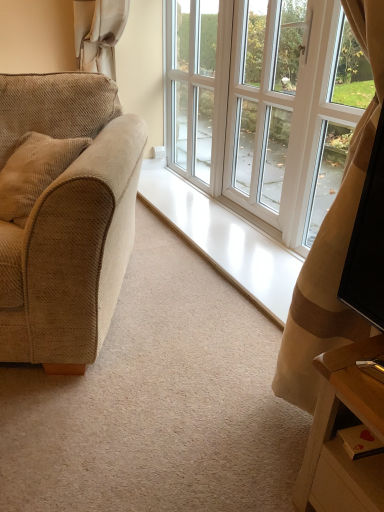
Question: Does white glass screen door at upper center, acting as the second screen door starting from the right, come in front of white glass window at center?

Choices:
 (A) yes
 (B) no

Answer: (B)

Question: From a real-world perspective, is white glass screen door at upper center, acting as the second screen door starting from the right, located higher than white glass window at center?

Choices:
 (A) no
 (B) yes

Answer: (B)

Question: Is white glass screen door at upper center, the first screen door in the left-to-right sequence, turned away from white glass window at center?

Choices:
 (A) no
 (B) yes

Answer: (A)

Question: Considering the relative sizes of white glass screen door at upper center, the first screen door in the left-to-right sequence, and white glass window at center in the image provided, is white glass screen door at upper center, the first screen door in the left-to-right sequence, bigger than white glass window at center?

Choices:
 (A) yes
 (B) no

Answer: (B)

Question: Is the depth of white glass screen door at upper center, acting as the second screen door starting from the right, greater than that of white glass window at center?

Choices:
 (A) no
 (B) yes

Answer: (B)

Question: Considering the positions of beige corduroy couch at left and white glass screen door at upper center, the first screen door in the left-to-right sequence, in the image, is beige corduroy couch at left taller or shorter than white glass screen door at upper center, the first screen door in the left-to-right sequence,?

Choices:
 (A) short
 (B) tall

Answer: (A)

Question: Looking at the image, does beige corduroy couch at left seem bigger or smaller compared to white glass screen door at upper center, the first screen door in the left-to-right sequence?

Choices:
 (A) small
 (B) big

Answer: (B)

Question: Considering the positions of point (46, 132) and point (167, 96), is point (46, 132) closer or farther from the camera than point (167, 96)?

Choices:
 (A) closer
 (B) farther

Answer: (A)

Question: Is beige corduroy couch at left situated inside white glass screen door at upper center, the first screen door in the left-to-right sequence, or outside?

Choices:
 (A) outside
 (B) inside

Answer: (A)

Question: Based on their sizes in the image, would you say white glossy screen door at center, which is the 2th screen door from left to right, is bigger or smaller than white glass window at center?

Choices:
 (A) small
 (B) big

Answer: (A)

Question: From a real-world perspective, relative to white glass window at center, is white glossy screen door at center, acting as the 1th screen door starting from the right, vertically above or below?

Choices:
 (A) above
 (B) below

Answer: (A)

Question: Is point (269, 94) positioned closer to the camera than point (168, 96)?

Choices:
 (A) closer
 (B) farther

Answer: (A)

Question: In terms of height, does white glossy screen door at center, which is the 2th screen door from left to right, look taller or shorter compared to white glass window at center?

Choices:
 (A) tall
 (B) short

Answer: (B)

Question: Considering their positions, is white glass screen door at upper center, acting as the second screen door starting from the right, located in front of or behind beige corduroy couch at left?

Choices:
 (A) front
 (B) behind

Answer: (B)

Question: Is white glass screen door at upper center, acting as the second screen door starting from the right, spatially inside beige corduroy couch at left, or outside of it?

Choices:
 (A) outside
 (B) inside

Answer: (A)